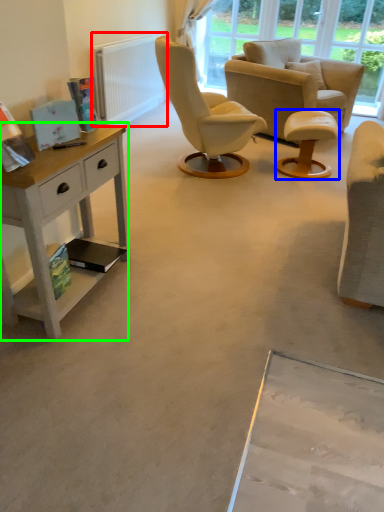
Question: Considering the real-world distances, which object is farthest from radiator (highlighted by a red box)? stool (highlighted by a blue box) or desk (highlighted by a green box)?

Choices:
 (A) stool
 (B) desk

Answer: (B)